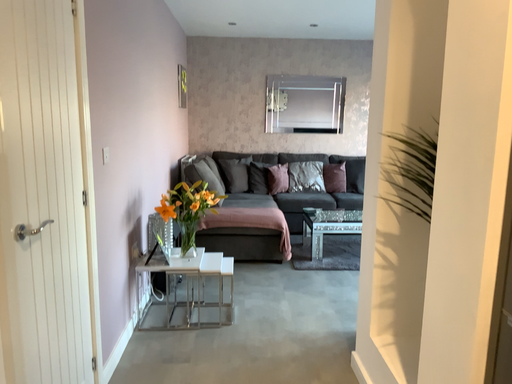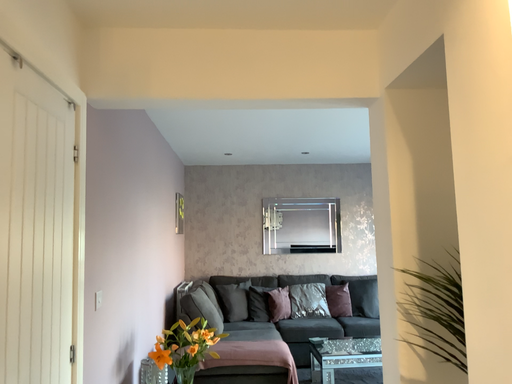
Question: Which way did the camera rotate in the video?

Choices:
 (A) rotated upward
 (B) rotated downward

Answer: (A)